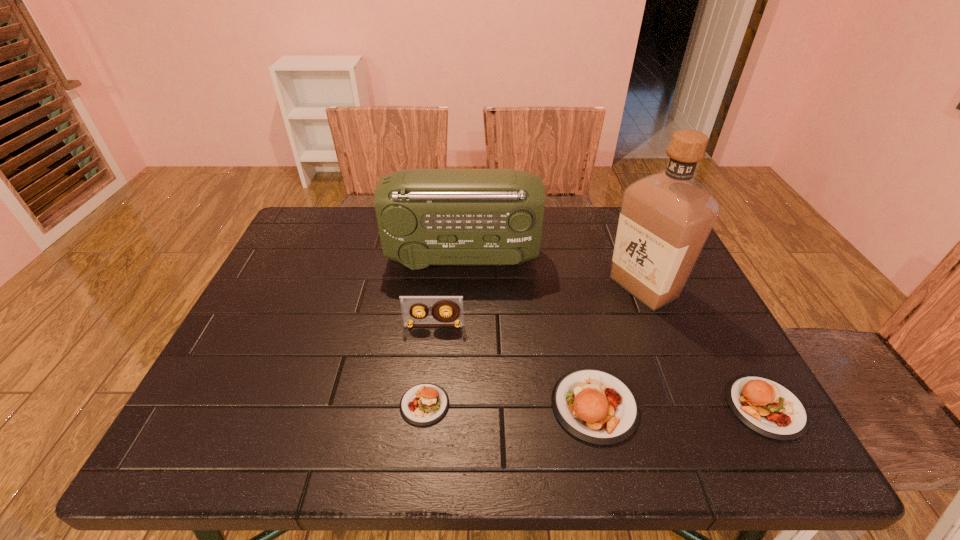
The height and width of the screenshot is (540, 960). What are the coordinates of `the leftmost patty (food)` in the screenshot? It's located at (424, 404).

What are the coordinates of `the shortest patty (food)` in the screenshot? It's located at (424, 404).

You are a GUI agent. You are given a task and a screenshot of the screen. Output one action in this format:
    pyautogui.click(x=<x>, y=<y>)
    Task: Click on the second patty (food) from right to left
    
    Given the screenshot: What is the action you would take?
    pyautogui.click(x=594, y=406)

Locate an element on the screen. This screenshot has width=960, height=540. the second tallest patty (food) is located at coordinates (767, 407).

Find the location of a particular element. the rightmost patty (food) is located at coordinates (767, 407).

Where is `radio_receiver`? radio_receiver is located at coordinates (426, 217).

Image resolution: width=960 pixels, height=540 pixels. Find the location of `the fourth nearest object`. the fourth nearest object is located at coordinates (410, 305).

Locate an element on the screen. the third tallest object is located at coordinates (410, 305).

I want to click on liquor, so click(x=665, y=219).

Where is `free point located on the back of the shortest patty (food)`? This screenshot has width=960, height=540. free point located on the back of the shortest patty (food) is located at coordinates click(x=430, y=357).